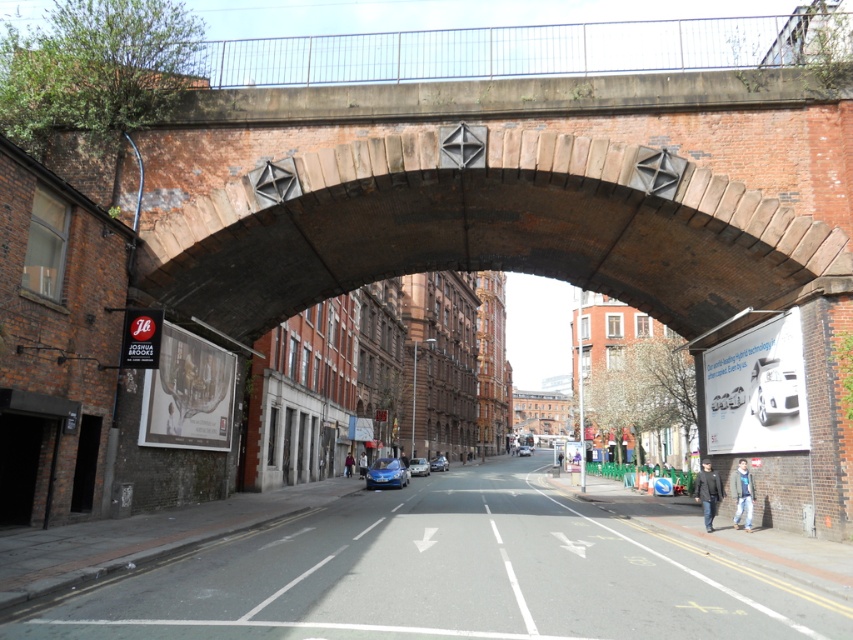
Question: Can you confirm if white glossy car at center is positioned above shiny blue sedan at center?

Choices:
 (A) no
 (B) yes

Answer: (B)

Question: Which point is farther to the camera?

Choices:
 (A) white glossy car at center
 (B) shiny blue sedan at center

Answer: (B)

Question: Which of these objects is positioned farthest from the shiny blue car at center?

Choices:
 (A) metallic blue car at center
 (B) white glossy car at center

Answer: (B)

Question: Is white glossy car at center positioned before shiny blue sedan at center?

Choices:
 (A) yes
 (B) no

Answer: (A)

Question: Which of these objects is positioned closest to the metallic blue car at center?

Choices:
 (A) smooth asphalt road at center
 (B) shiny blue car at center
 (C) white glossy car at center

Answer: (A)

Question: Can you confirm if shiny blue car at center is bigger than blue metallic car at center?

Choices:
 (A) no
 (B) yes

Answer: (B)